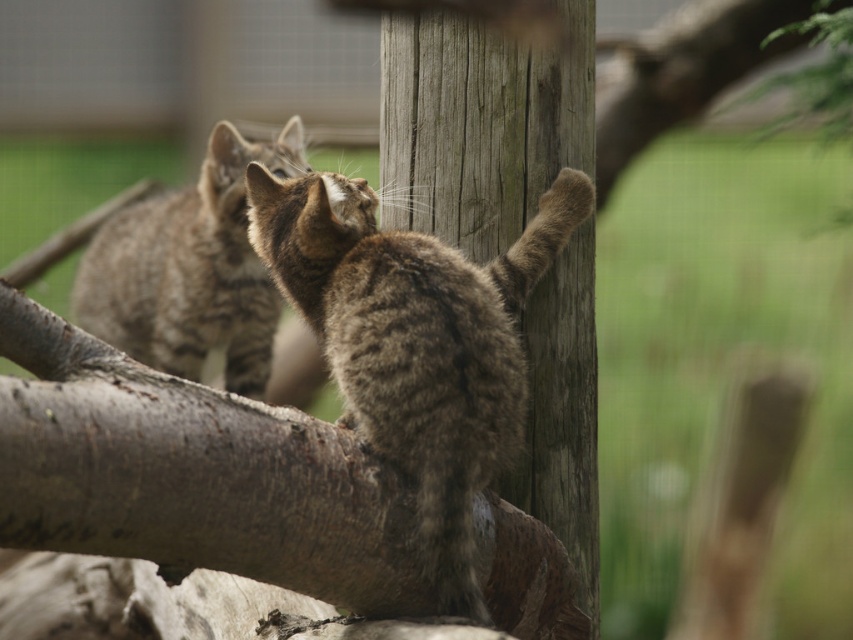
Question: Among these objects, which one is farthest from the camera?

Choices:
 (A) brown fur cat at center
 (B) tabby fur cat at upper left

Answer: (B)

Question: Does brown fur cat at center come behind tabby fur cat at upper left?

Choices:
 (A) yes
 (B) no

Answer: (B)

Question: Does brown fur cat at center have a greater width compared to tabby fur cat at upper left?

Choices:
 (A) no
 (B) yes

Answer: (A)

Question: Is brown fur cat at center to the right of tabby fur cat at upper left from the viewer's perspective?

Choices:
 (A) yes
 (B) no

Answer: (A)

Question: Among these points, which one is farthest from the camera?

Choices:
 (A) (242, 328)
 (B) (440, 248)

Answer: (A)

Question: Among these points, which one is farthest from the camera?

Choices:
 (A) (416, 442)
 (B) (234, 177)

Answer: (B)